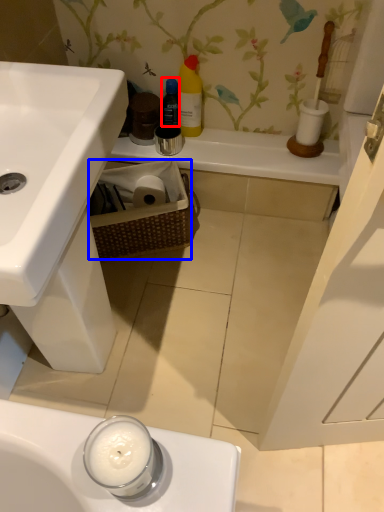
Question: Which of the following is the farthest to the observer, bottle (highlighted by a red box) or basket (highlighted by a blue box)?

Choices:
 (A) bottle
 (B) basket

Answer: (A)